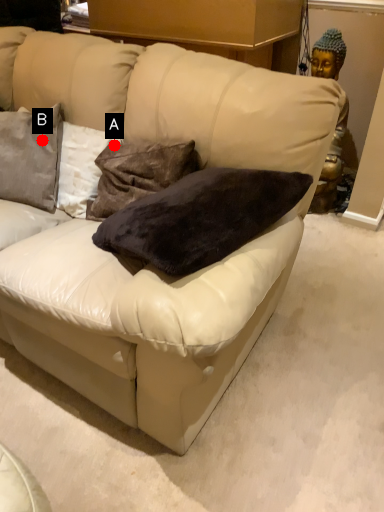
Question: Two points are circled on the image, labeled by A and B beside each circle. Which point appears farthest from the camera in this image?

Choices:
 (A) A is further
 (B) B is further

Answer: (B)